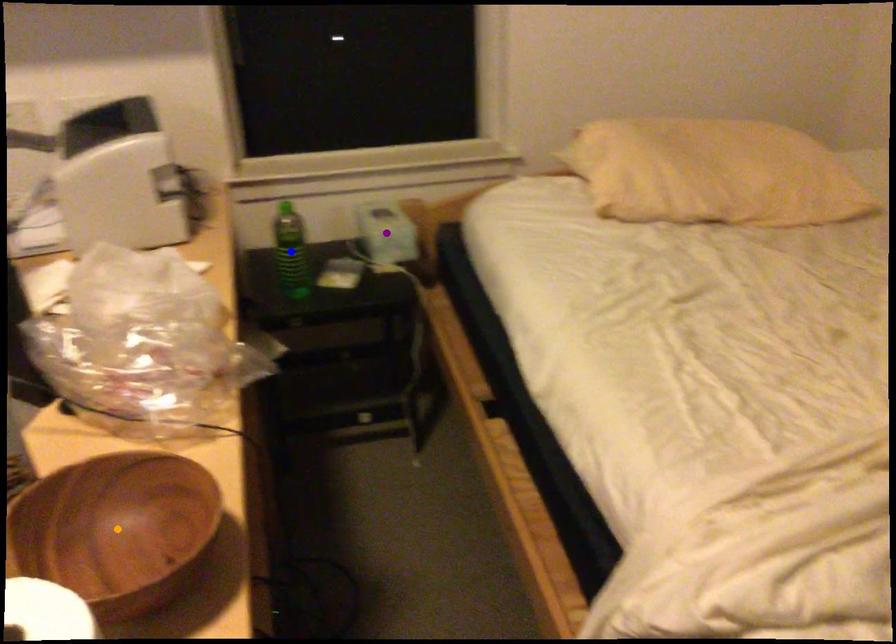
Order these from farthest to nearest:
purple point
blue point
orange point

1. purple point
2. blue point
3. orange point